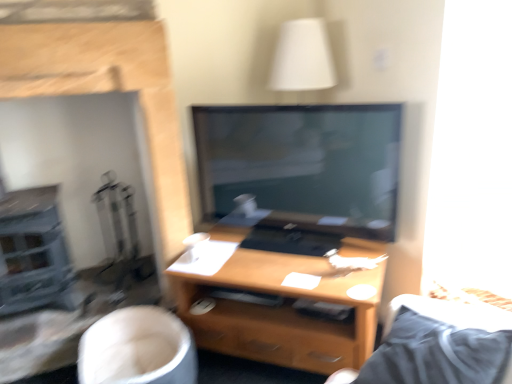
Identify the location of free point above smooth stone fireplace at left (from a real-world perspective). This screenshot has width=512, height=384. (66, 22).